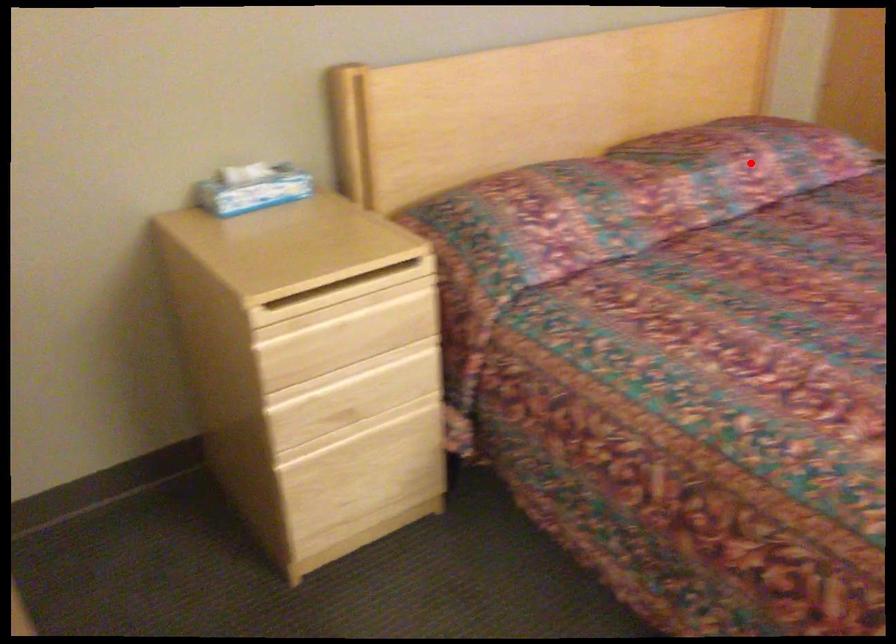
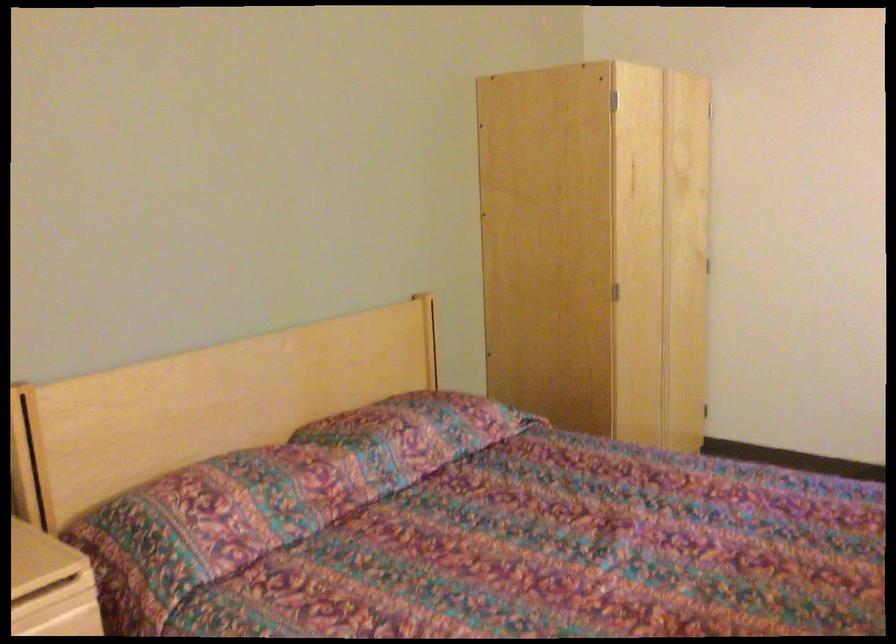
Question: I am providing you with two images of the same scene from different viewpoints. In image1, a red point is highlighted. Considering the same 3D point in image2, which of the following is correct?

Choices:
 (A) It is closer
 (B) It is farther

Answer: (B)